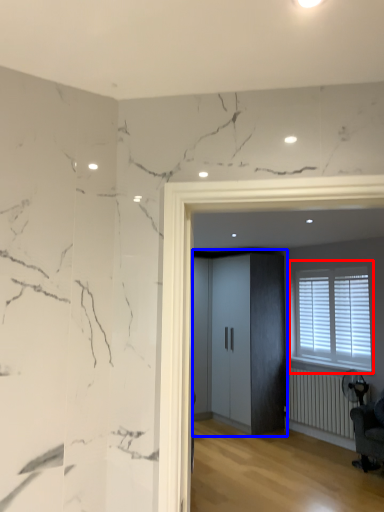
Question: Among these objects, which one is nearest to the camera, window (highlighted by a red box) or elevator (highlighted by a blue box)?

Choices:
 (A) window
 (B) elevator

Answer: (A)